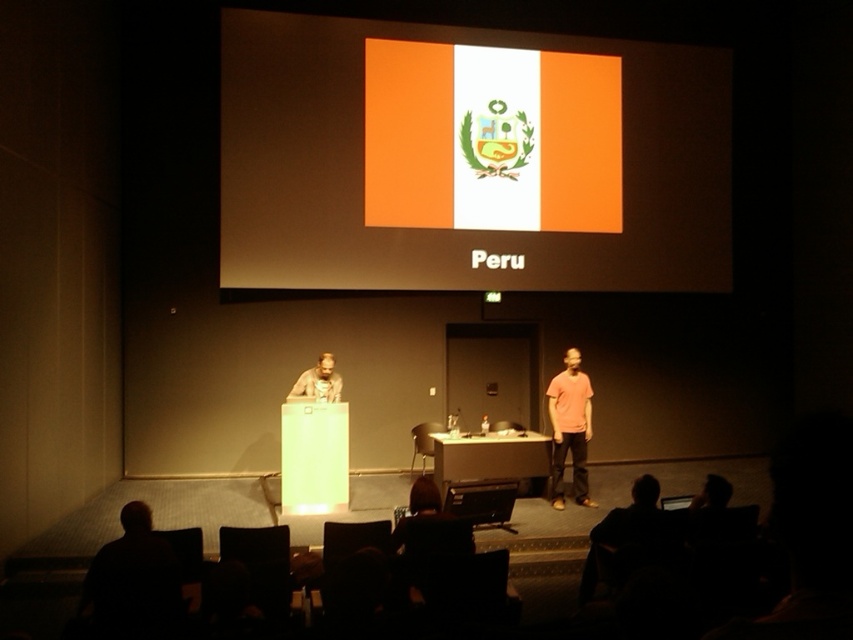
Question: Which object is the farthest from the matte wooden podium at center?

Choices:
 (A) orange cotton t-shirt at right
 (B) orange matte flag at upper center

Answer: (B)

Question: Estimate the real-world distances between objects in this image. Which object is farther from the matte wooden podium at center?

Choices:
 (A) orange matte flag at upper center
 (B) orange cotton t-shirt at right

Answer: (A)

Question: Can you confirm if orange matte flag at upper center is positioned to the right of orange cotton t-shirt at right?

Choices:
 (A) yes
 (B) no

Answer: (B)

Question: Can you confirm if orange matte flag at upper center is positioned to the left of matte wooden podium at center?

Choices:
 (A) no
 (B) yes

Answer: (B)

Question: Is orange matte flag at upper center in front of orange cotton t-shirt at right?

Choices:
 (A) no
 (B) yes

Answer: (A)

Question: Which of the following is the farthest from the observer?

Choices:
 (A) orange cotton t-shirt at right
 (B) orange matte flag at upper center
 (C) matte wooden podium at center

Answer: (B)